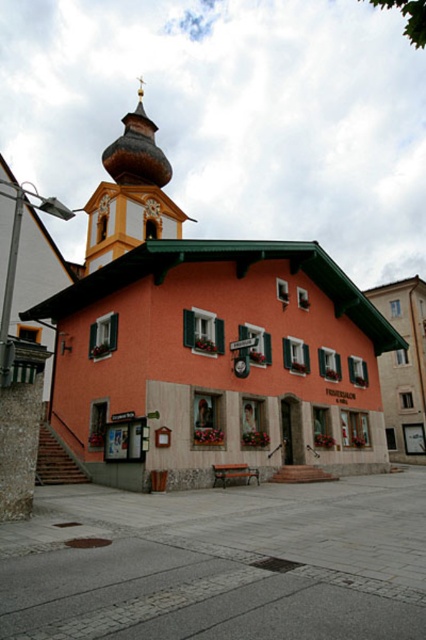
Between orange painted wooden church at center and gold textured spire at upper center, which one has more height?

Standing taller between the two is orange painted wooden church at center.

Between orange painted wooden church at center and gold textured spire at upper center, which one appears on the right side from the viewer's perspective?

orange painted wooden church at center

Identify the location of orange painted wooden church at center. The height and width of the screenshot is (640, 426). (207, 342).

Which of these two, gray concrete plaza at lower center or gold textured spire at upper center, stands shorter?

With less height is gray concrete plaza at lower center.

Is the position of gray concrete plaza at lower center less distant than that of gold textured spire at upper center?

Yes, gray concrete plaza at lower center is in front of gold textured spire at upper center.

Is point (354, 502) closer to camera compared to point (109, 182)?

Yes, it is.

Where is `gray concrete plaza at lower center`? Image resolution: width=426 pixels, height=640 pixels. gray concrete plaza at lower center is located at coordinates (221, 563).

Which of these two, orange painted wooden church at center or gray concrete plaza at lower center, stands shorter?

gray concrete plaza at lower center

Does orange painted wooden church at center appear on the right side of gray concrete plaza at lower center?

Incorrect, orange painted wooden church at center is not on the right side of gray concrete plaza at lower center.

Find the location of a particular element. orange painted wooden church at center is located at coordinates (207, 342).

The width and height of the screenshot is (426, 640). Find the location of `orange painted wooden church at center`. orange painted wooden church at center is located at coordinates (207, 342).